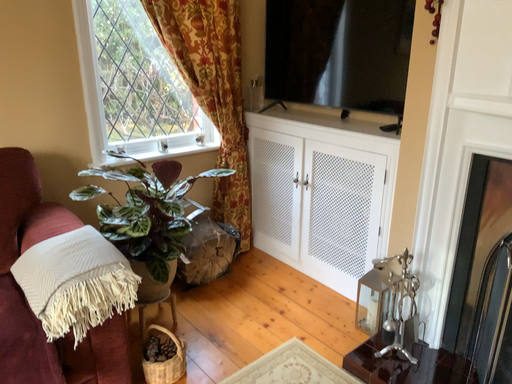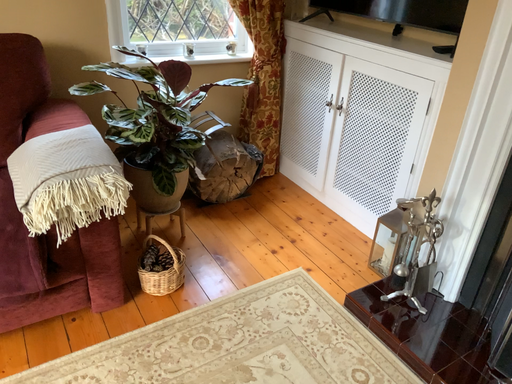
Question: How did the camera likely rotate when shooting the video?

Choices:
 (A) rotated left
 (B) rotated right

Answer: (A)